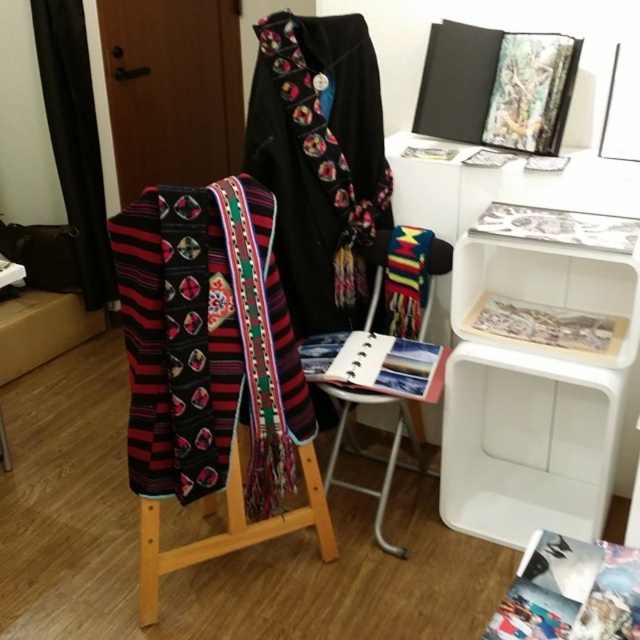
Question: Does black embroidered robe at center have a greater width compared to wooden stool at center?

Choices:
 (A) yes
 (B) no

Answer: (B)

Question: Is black embroidered robe at center to the right of wooden stool at center from the viewer's perspective?

Choices:
 (A) yes
 (B) no

Answer: (A)

Question: Is white plastic table at upper right smaller than wooden stool at center?

Choices:
 (A) yes
 (B) no

Answer: (B)

Question: Estimate the real-world distances between objects in this image. Which object is farther from the white plastic table at upper right?

Choices:
 (A) wooden stool at center
 (B) wooden folding chair at center
 (C) black embroidered robe at center
 (D) embroidered wool scarf at center

Answer: (D)

Question: Based on their relative distances, which object is nearer to the embroidered wool scarf at center?

Choices:
 (A) black embroidered robe at center
 (B) wooden stool at center

Answer: (B)

Question: Which point is farther from the camera taking this photo?

Choices:
 (A) (157, 577)
 (B) (275, 141)

Answer: (B)